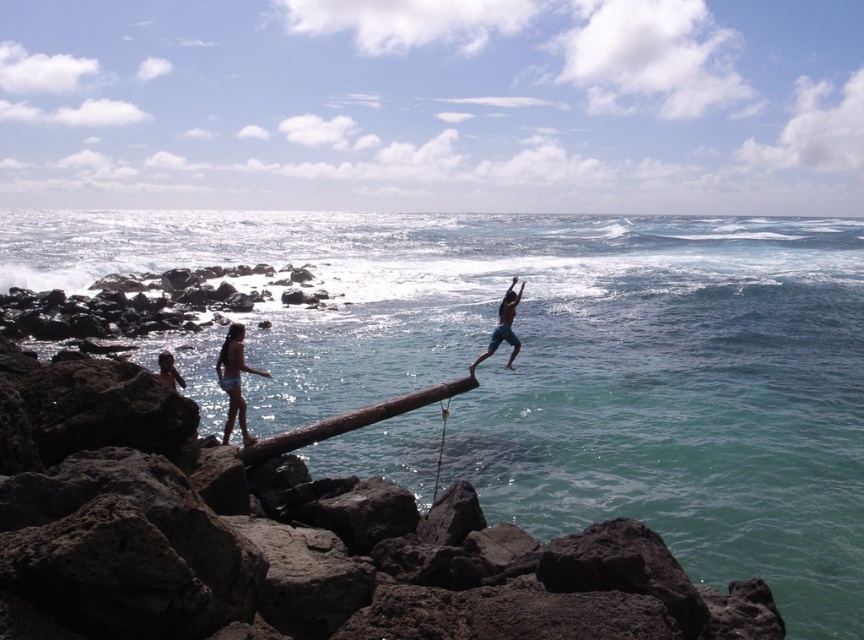
Question: Which of the following is the farthest from the observer?

Choices:
 (A) click(471, 365)
 (B) click(230, 419)
 (C) click(176, 371)

Answer: (A)

Question: Which of the following is the farthest from the observer?

Choices:
 (A) (712, 467)
 (B) (471, 372)
 (C) (220, 369)
 (D) (305, 445)

Answer: (A)

Question: Considering the real-world distances, which object is farthest from the matte blue shorts at left?

Choices:
 (A) light brown wooden stick at lower left
 (B) brown wood log at center

Answer: (B)

Question: Is matte blue shorts at left positioned at the back of light brown wooden stick at lower left?

Choices:
 (A) yes
 (B) no

Answer: (A)

Question: Can you confirm if matte blue shorts at left is wider than blue denim shorts at center?

Choices:
 (A) no
 (B) yes

Answer: (A)

Question: Is matte blue shorts at left wider than light brown wooden stick at lower left?

Choices:
 (A) no
 (B) yes

Answer: (A)